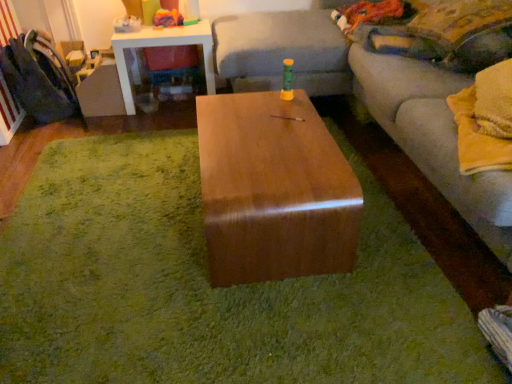
Identify the location of free point in front of shiny brown wood coffee table at center. The image size is (512, 384). (268, 319).